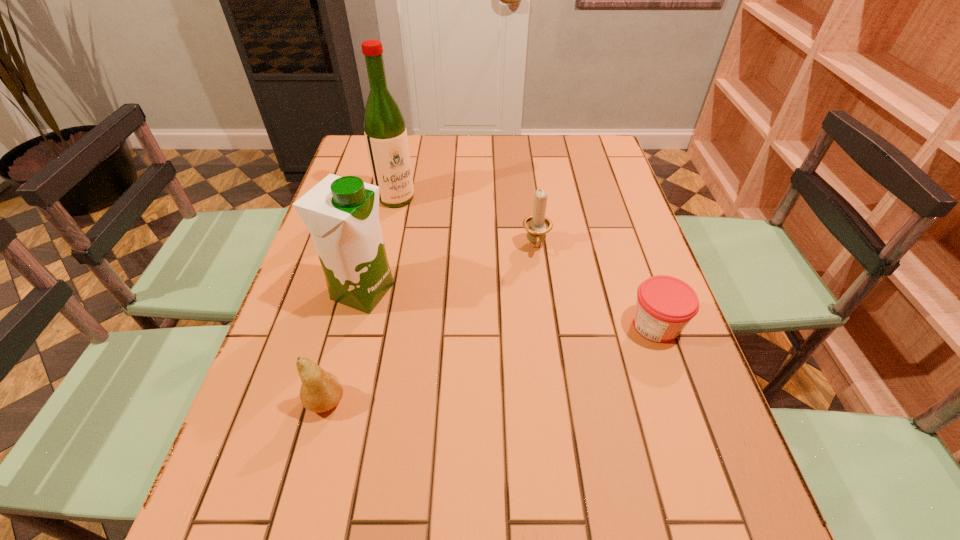
The height and width of the screenshot is (540, 960). I want to click on the nearest object, so click(320, 391).

Find the location of a particular element. This screenshot has width=960, height=540. pear is located at coordinates (320, 391).

Identify the location of the rightmost object. The height and width of the screenshot is (540, 960). (665, 305).

Find the location of `jam`. jam is located at coordinates (665, 305).

Locate an element on the screen. This screenshot has height=540, width=960. the tallest object is located at coordinates (385, 132).

This screenshot has width=960, height=540. Identify the location of liquor. (385, 132).

Where is `the fourth object from left to right`? the fourth object from left to right is located at coordinates (537, 225).

At what (x,y) coordinates should I click in order to perform the action: click on candle_holder. Please return your answer as a coordinate pair (x, y). The height and width of the screenshot is (540, 960). Looking at the image, I should click on (537, 225).

Locate an element on the screen. soya milk is located at coordinates coord(341,213).

Find the location of a particular element. Image resolution: width=960 pixels, height=540 pixels. vacant area located 0.230m on the right of the pear is located at coordinates (463, 402).